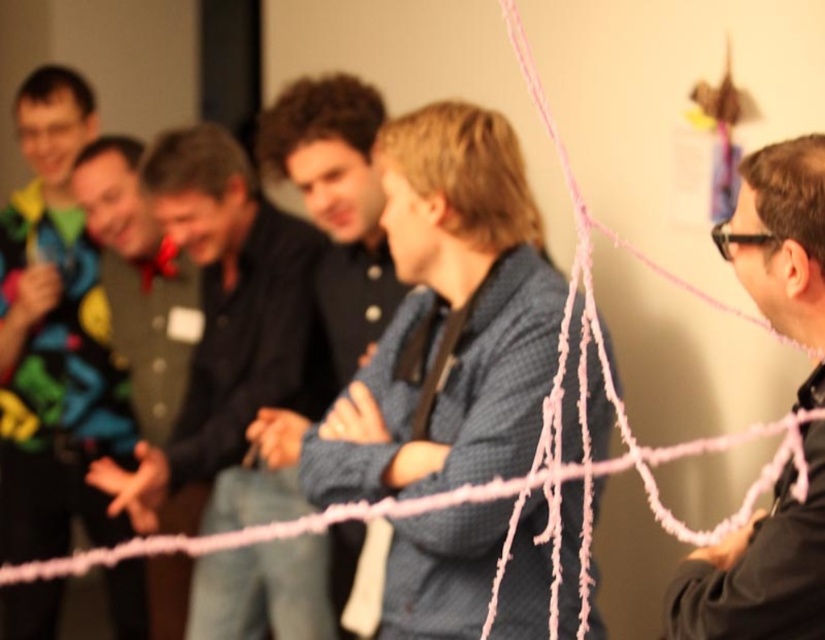
Measure the distance between multicolored fabric vest at left and dark brown leather jacket at center.

multicolored fabric vest at left is 22.84 inches from dark brown leather jacket at center.

Who is positioned more to the left, multicolored fabric vest at left or dark brown leather jacket at center?

multicolored fabric vest at left

Which is in front, point (88, 532) or point (144, 164)?

Point (144, 164)

Where is `multicolored fabric vest at left`? multicolored fabric vest at left is located at coordinates (54, 337).

Based on the photo, which is more to the right, blue textured shirt at center or black matte glasses at right?

Positioned to the right is black matte glasses at right.

Locate an element on the screen. Image resolution: width=825 pixels, height=640 pixels. blue textured shirt at center is located at coordinates (446, 320).

Consider the image. Does black matte glasses at right have a greater height compared to black plastic goggles at right?

Indeed, black matte glasses at right has a greater height compared to black plastic goggles at right.

Who is more forward, (x=807, y=179) or (x=752, y=236)?

Point (x=807, y=179) is in front.

Image resolution: width=825 pixels, height=640 pixels. What are the coordinates of `black matte glasses at right` in the screenshot? It's located at (759, 568).